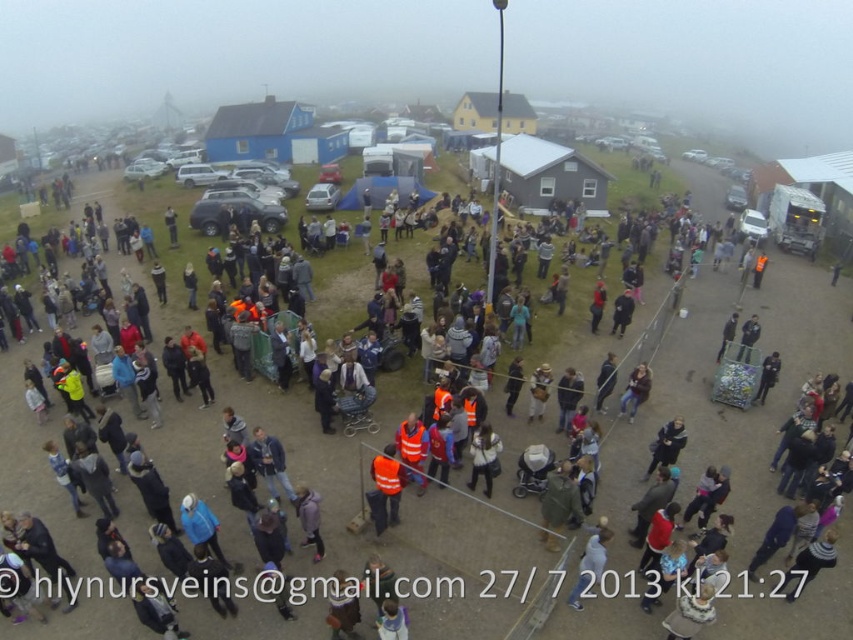
Who is higher up, white fabric jacket at center or leather jacket at center?

leather jacket at center

Does white fabric jacket at center have a smaller size compared to leather jacket at center?

Actually, white fabric jacket at center might be larger than leather jacket at center.

Which is behind, point (479, 433) or point (650, 380)?

The point (650, 380) is behind.

The width and height of the screenshot is (853, 640). I want to click on white fabric jacket at center, so click(485, 458).

Is white fabric jacket at lower center positioned at the back of white fabric jacket at center?

No, it is not.

Can you confirm if white fabric jacket at lower center is wider than white fabric jacket at center?

Yes, white fabric jacket at lower center is wider than white fabric jacket at center.

What are the coordinates of `white fabric jacket at lower center` in the screenshot? It's located at (590, 563).

Based on the photo, does white fabric jacket at lower center lie behind leather jacket at center?

No, white fabric jacket at lower center is closer to the viewer.

Between white fabric jacket at lower center and leather jacket at center, which one appears on the left side from the viewer's perspective?

From the viewer's perspective, white fabric jacket at lower center appears more on the left side.

You are a GUI agent. You are given a task and a screenshot of the screen. Output one action in this format:
    pyautogui.click(x=<x>, y=<y>)
    Task: Click on the white fabric jacket at lower center
    The image size is (853, 640).
    Given the screenshot: What is the action you would take?
    pyautogui.click(x=590, y=563)